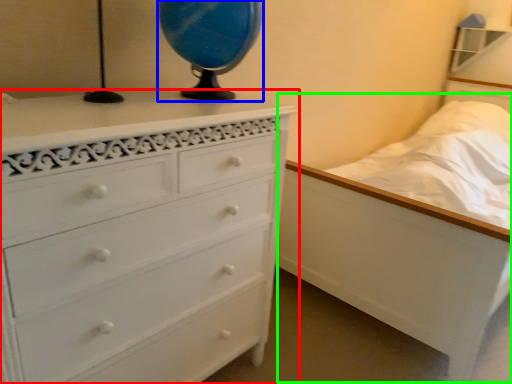
Question: Considering the real-world distances, which object is closest to chest of drawers (highlighted by a red box)? table lamp (highlighted by a blue box) or bed (highlighted by a green box).

Choices:
 (A) table lamp
 (B) bed

Answer: (A)